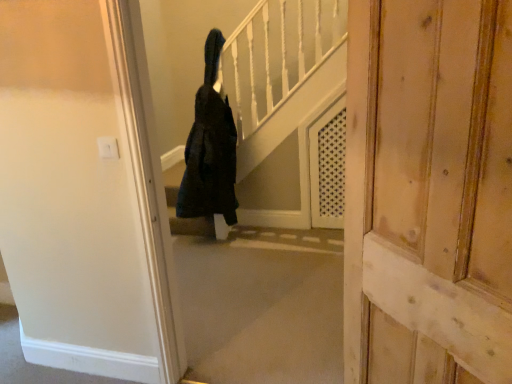
Locate an element on the screen. The height and width of the screenshot is (384, 512). free location in front of black fuzzy coat at center is located at coordinates (225, 243).